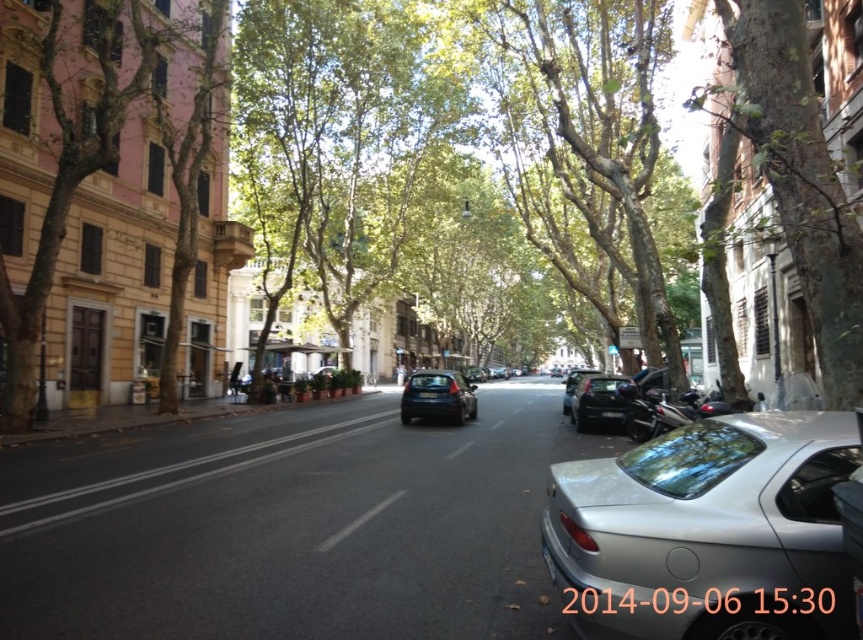
You are a delivery person who needs to park a 20 feet long truck between the silver metallic car at center and the glossy black car at center. Based on the scene, can you fit the truck in the space between them?

The distance between the silver metallic car at center and the glossy black car at center is 41.00 feet. Since the truck is 20 feet long, there is sufficient space to park it between them as 41 feet is greater than 20 feet.

You are a delivery person trying to park your silver metallic car at center in the street. The black asphalt road at center is the only available space. Can you park your car there?

The silver metallic car at center is smaller than the black asphalt road at center, so yes, you can park your silver metallic car at center there as it will fit within the space provided by the black asphalt road at center.